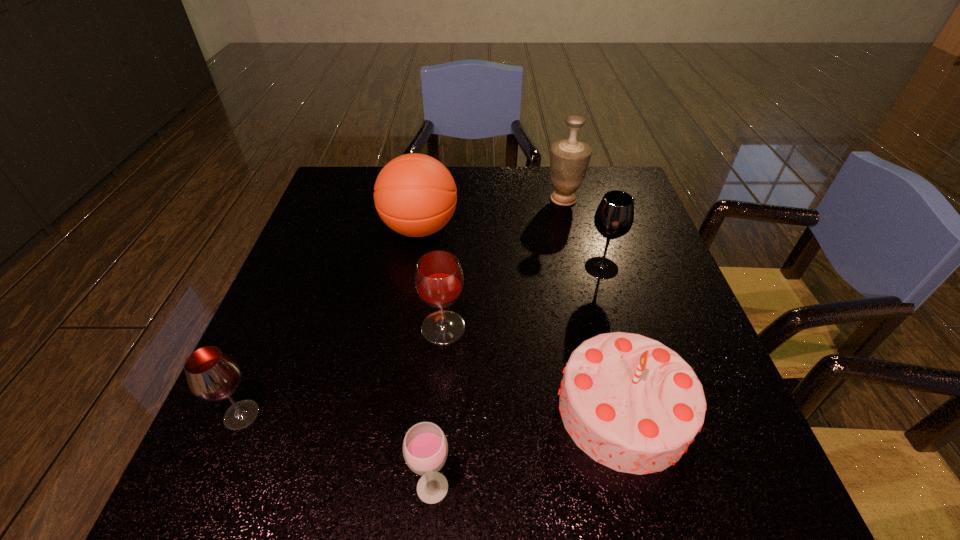
The image size is (960, 540). Identify the location of urn. (569, 158).

You are a GUI agent. You are given a task and a screenshot of the screen. Output one action in this format:
    pyautogui.click(x=<x>, y=<y>)
    Task: Click on the basketball
    
    Given the screenshot: What is the action you would take?
    pyautogui.click(x=415, y=195)

Find the location of `the fifth nearest object`. the fifth nearest object is located at coordinates (614, 217).

This screenshot has width=960, height=540. Identify the location of the rightmost wineglass. (614, 217).

What are the coordinates of `the fourth nearest object` in the screenshot? It's located at click(x=439, y=280).

In order to click on birthday cake in this screenshot , I will do `click(631, 403)`.

The image size is (960, 540). In order to click on the leftmost wineglass in this screenshot , I will do `click(212, 375)`.

Locate an element on the screen. the leftmost object is located at coordinates (212, 375).

Find the location of a particular element. The width and height of the screenshot is (960, 540). the nearest wineglass is located at coordinates (425, 448).

The height and width of the screenshot is (540, 960). Find the location of `vacant space located on the front of the urn`. vacant space located on the front of the urn is located at coordinates (590, 310).